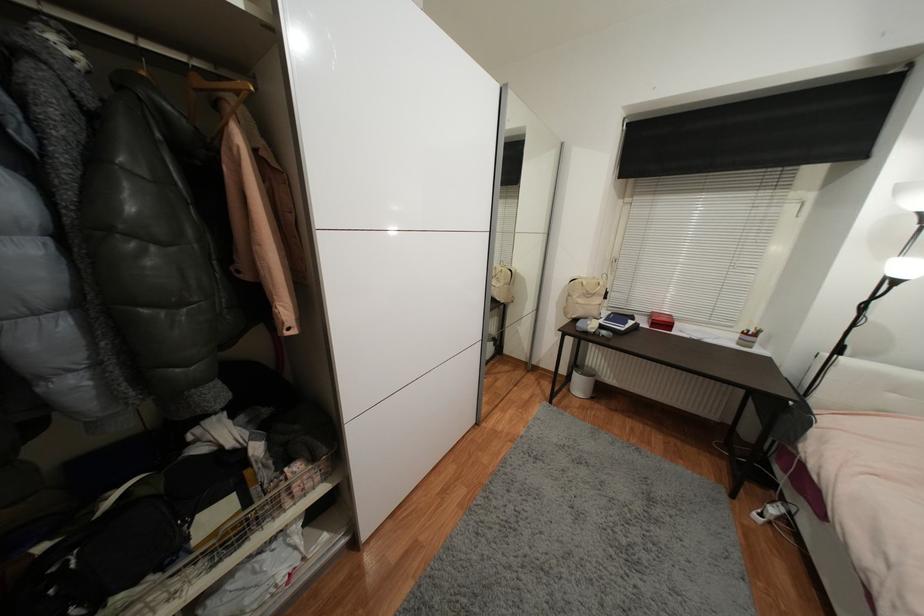
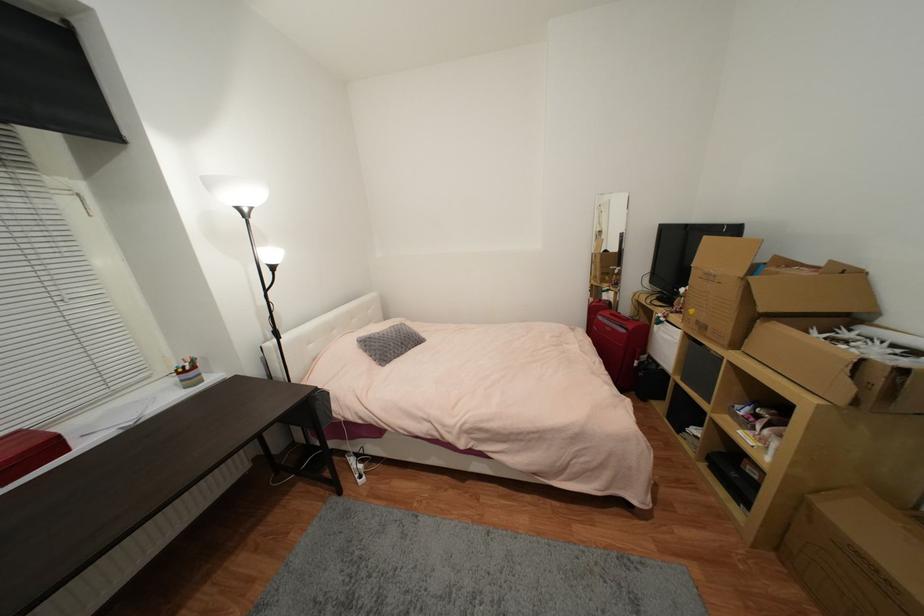
Locate, in the second image, the point that corresponds to the point at 842,354 in the first image.

(283, 339)